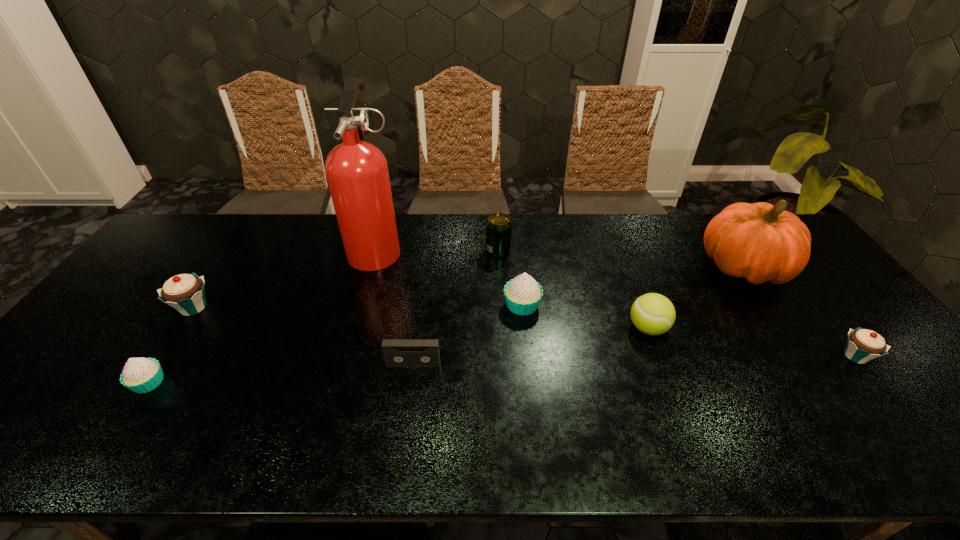
The width and height of the screenshot is (960, 540). I want to click on object present at the far right corner, so click(760, 242).

I want to click on vacant region at the far edge of the desktop, so click(535, 236).

In the image, there is a desktop. Where is `vacant area at the near edge`? vacant area at the near edge is located at coordinates (756, 440).

You are a GUI agent. You are given a task and a screenshot of the screen. Output one action in this format:
    pyautogui.click(x=<x>, y=<y>)
    Task: Click on the free location at the left edge of the desktop
    The image size is (960, 540).
    Given the screenshot: What is the action you would take?
    pyautogui.click(x=103, y=347)

Find the location of `free space between the fire extinguisher and the rightmost cupcake`. free space between the fire extinguisher and the rightmost cupcake is located at coordinates (616, 302).

Find the location of `free spot between the green beer can and the pumpkin`. free spot between the green beer can and the pumpkin is located at coordinates (620, 259).

Locate an element on the screen. Image resolution: width=960 pixels, height=540 pixels. free space between the seventh object from left to right and the orange pumpkin is located at coordinates (695, 298).

The height and width of the screenshot is (540, 960). In order to click on free space between the bigger teal cupcake and the fire extinguisher in this screenshot , I will do `click(285, 278)`.

Find the location of a particular element. Image resolution: width=960 pixels, height=540 pixels. empty location between the bigger teal cupcake and the second tallest object is located at coordinates (468, 287).

Locate an element on the screen. vacant area between the smaller white cupcake and the bigger teal cupcake is located at coordinates (171, 345).